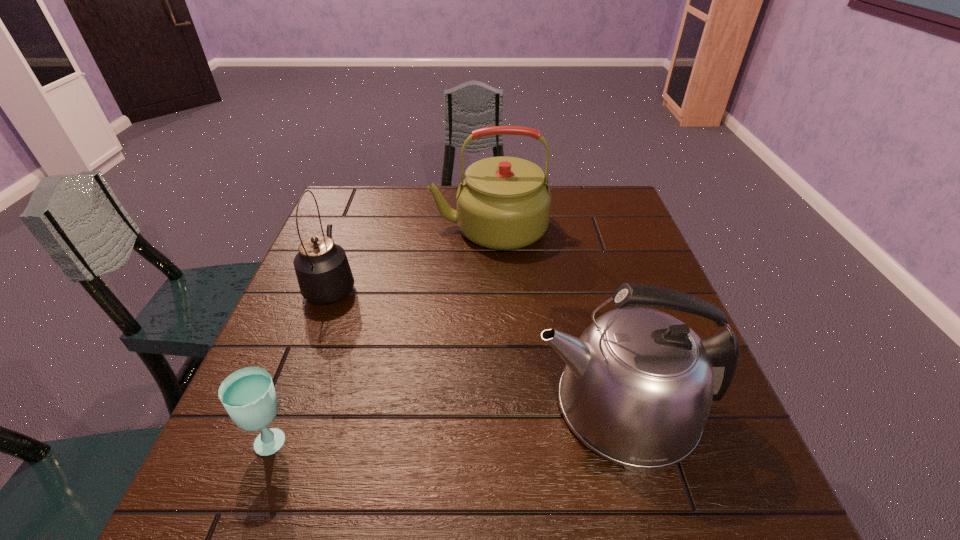
Find the location of a particular element. object positioned at the near right corner is located at coordinates (637, 388).

The width and height of the screenshot is (960, 540). I want to click on free space at the far edge, so click(406, 192).

The image size is (960, 540). In the image, there is a desktop. Find the location of `vacant area at the near edge`. vacant area at the near edge is located at coordinates (547, 504).

This screenshot has width=960, height=540. I want to click on vacant region at the left edge of the desktop, so click(334, 237).

You are a GUI agent. You are given a task and a screenshot of the screen. Output one action in this format:
    pyautogui.click(x=<x>, y=<y>)
    Task: Click on the vacant space at the right edge of the desktop
    This screenshot has width=960, height=540.
    Given the screenshot: What is the action you would take?
    pyautogui.click(x=608, y=282)

In the image, there is a desktop. What are the coordinates of `vacant space at the far left corner` in the screenshot? It's located at (365, 221).

Locate an element on the screen. free space at the near left corner of the desktop is located at coordinates (208, 474).

Where is `vacant region at the near right corner of the desktop`? This screenshot has width=960, height=540. vacant region at the near right corner of the desktop is located at coordinates (719, 498).

The width and height of the screenshot is (960, 540). I want to click on unoccupied area between the farthest kettle and the nearest kettle, so click(556, 317).

You are a GUI agent. You are given a task and a screenshot of the screen. Output one action in this format:
    pyautogui.click(x=<x>, y=<y>)
    Task: Click on the empty location between the farthest object and the second nearest kettle
    Image resolution: width=960 pixels, height=540 pixels.
    Given the screenshot: What is the action you would take?
    pyautogui.click(x=410, y=256)